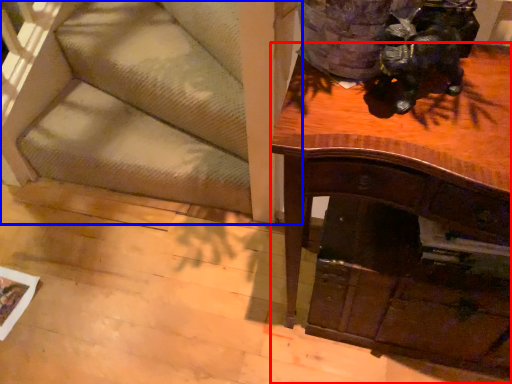
Question: Which object appears farthest to the camera in this image, desk (highlighted by a red box) or furniture (highlighted by a blue box)?

Choices:
 (A) desk
 (B) furniture

Answer: (B)